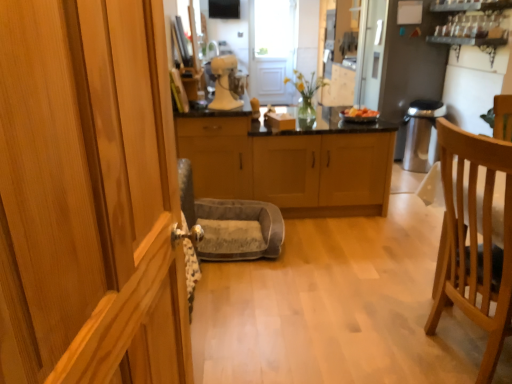
Question: In terms of height, does light wood cabinetry at center, the 3th cabinetry in the left-to-right sequence, look taller or shorter compared to light brown wood cabinet at center, which is the third cabinetry in back-to-front order?

Choices:
 (A) tall
 (B) short

Answer: (B)

Question: In the image, is light wood cabinetry at center, which ranks as the 1th cabinetry in back-to-front order, positioned in front of or behind light brown wood cabinet at center, the 2th cabinetry viewed from the right?

Choices:
 (A) behind
 (B) front

Answer: (A)

Question: Considering the real-world distances, which object is closest to the satin silver refrigerator at upper right?

Choices:
 (A) smooth plastic bowl at center
 (B) matte gray cabinet at center, which is counted as the 3th cabinetry, starting from the right
 (C) white matte stand mixer at center
 (D) translucent glass vase at center
 (E) light wood cabinetry at center, the 3th cabinetry in the left-to-right sequence

Answer: (D)

Question: Which is farther from the white matte stand mixer at center?

Choices:
 (A) satin silver refrigerator at upper right
 (B) light brown wooden chair at right
 (C) velvet gray pet bed at center
 (D) smooth plastic bowl at center
 (E) light wood cabinetry at center, arranged as the first cabinetry when viewed from the right

Answer: (A)